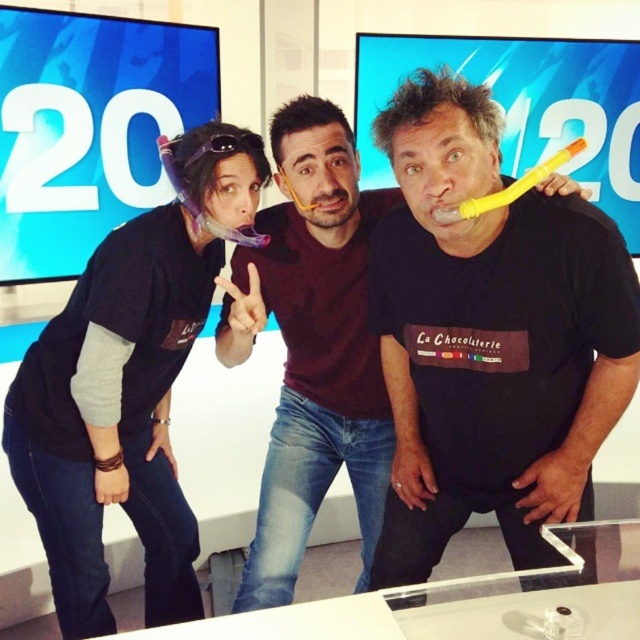
Question: Can you confirm if matte black t-shirt at center is wider than yellow rubber toothbrush at center?

Choices:
 (A) no
 (B) yes

Answer: (B)

Question: Estimate the real-world distances between objects in this image. Which object is farther from the black matte t-shirt at center?

Choices:
 (A) yellow rubber toothbrush at center
 (B) matte black t-shirt at center

Answer: (A)

Question: Which point is closer to the camera taking this photo?

Choices:
 (A) (321, 244)
 (B) (65, 356)
 (C) (540, 170)

Answer: (C)

Question: Can you confirm if matte black t-shirt at center is positioned above black matte t-shirt at center?

Choices:
 (A) yes
 (B) no

Answer: (B)

Question: Does matte black t-shirt at center appear over black matte t-shirt at center?

Choices:
 (A) no
 (B) yes

Answer: (A)

Question: Which point appears closest to the camera in this image?

Choices:
 (A) (108, 240)
 (B) (317, 288)

Answer: (A)